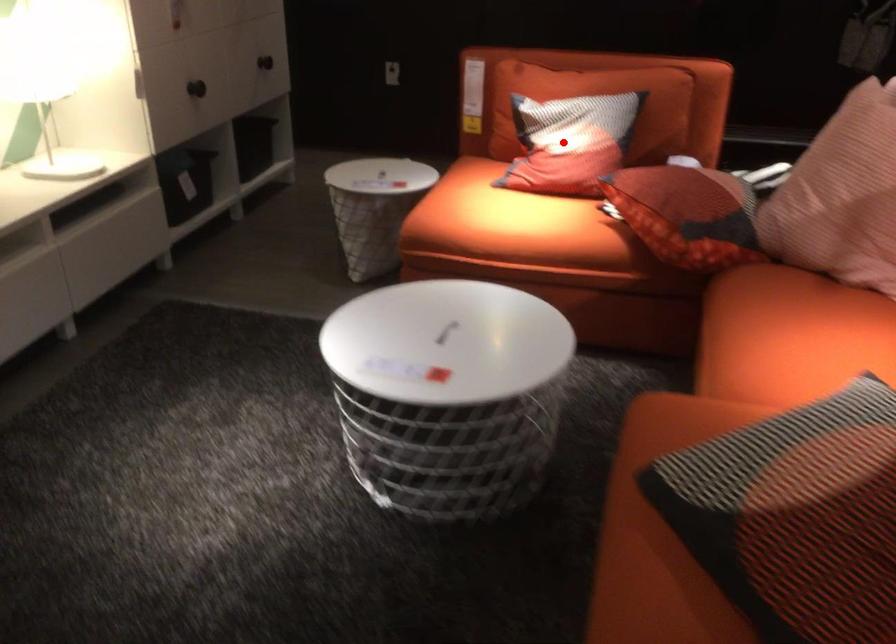
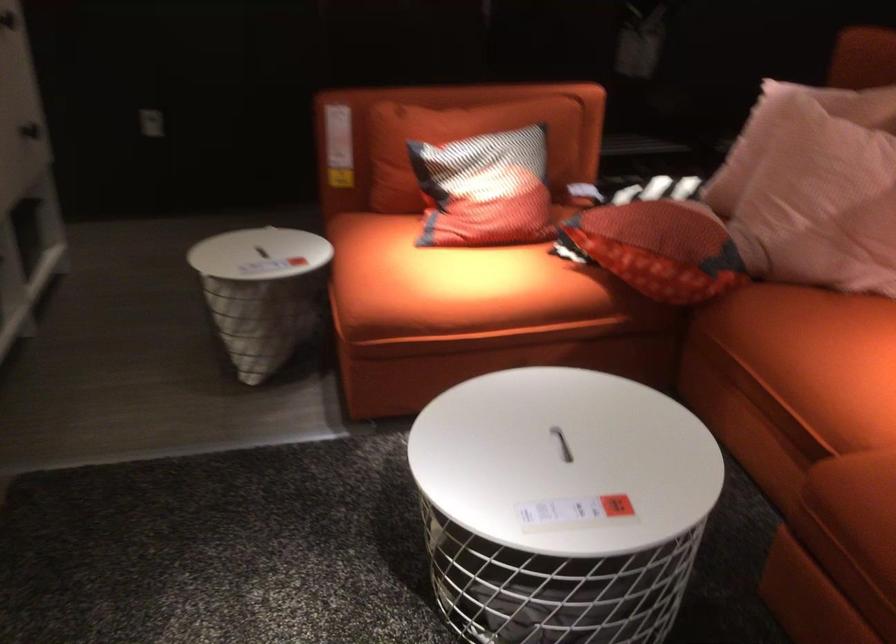
Question: A red point is marked in image1. In image2, is the corresponding 3D point closer to the camera or farther? Reply with the corresponding letter.

Choices:
 (A) The corresponding 3D point is closer.
 (B) The corresponding 3D point is farther.

Answer: (A)